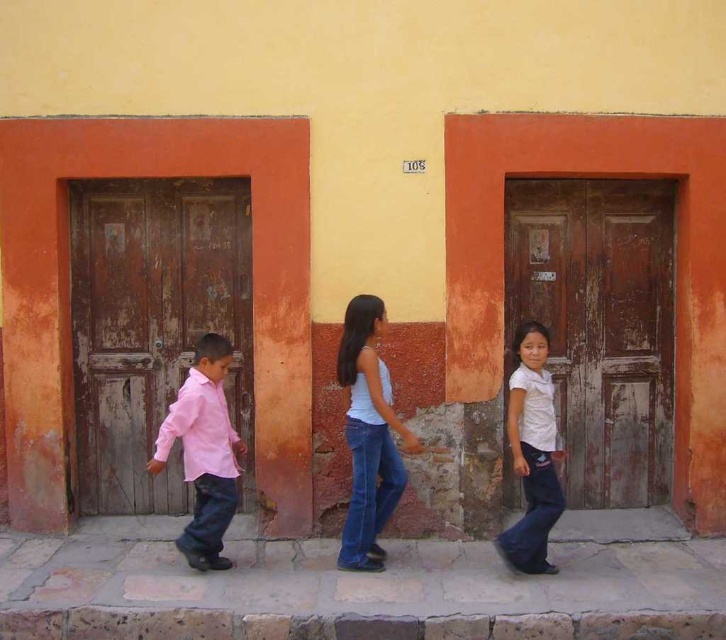
Does wooden door at right have a larger size compared to pink matte shirt at left?

Yes, wooden door at right is bigger than pink matte shirt at left.

Which is behind, point (603, 310) or point (216, 452)?

Point (603, 310)

This screenshot has width=726, height=640. What do you see at coordinates (600, 324) in the screenshot?
I see `wooden door at right` at bounding box center [600, 324].

The width and height of the screenshot is (726, 640). In order to click on wooden door at right in this screenshot , I will do tap(600, 324).

Is wooden door at right above white matte tank top at center?

Indeed, wooden door at right is positioned over white matte tank top at center.

Image resolution: width=726 pixels, height=640 pixels. What are the coordinates of `wooden door at right` in the screenshot? It's located at (600, 324).

In order to click on wooden door at right in this screenshot , I will do `click(600, 324)`.

Between wooden door at left and wooden door at right, which one has less height?

Standing shorter between the two is wooden door at left.

Is point (76, 433) farther from viewer compared to point (584, 433)?

No, it is in front of (584, 433).

Is point (138, 253) positioned behind point (643, 198)?

No, it is in front of (643, 198).

Locate an element on the screen. The height and width of the screenshot is (640, 726). wooden door at left is located at coordinates (150, 323).